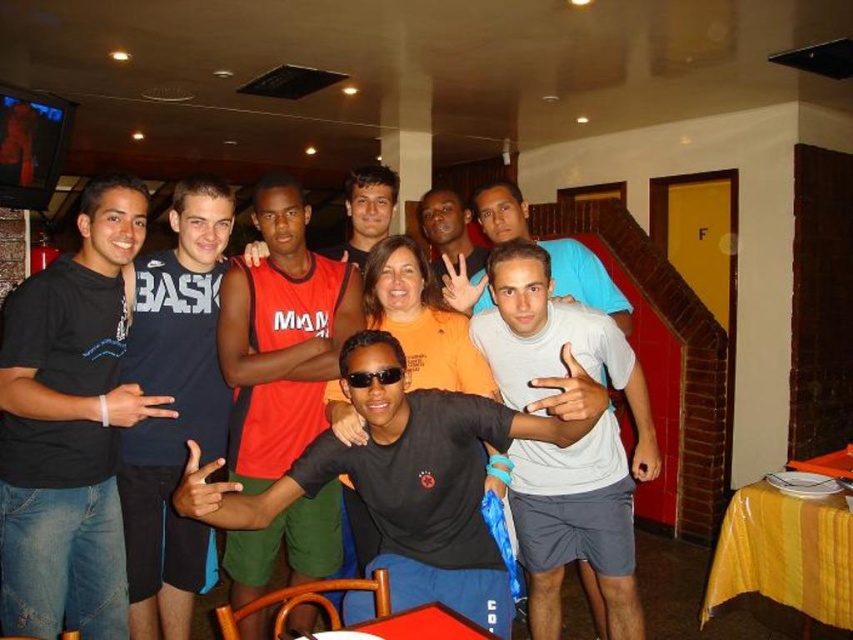
You are standing in the group photo and want to point to two specific spots. Which of the two points, point (123, 317) or point (274, 340), is closer to you?

Point (123, 317) is closer to the viewer than point (274, 340).